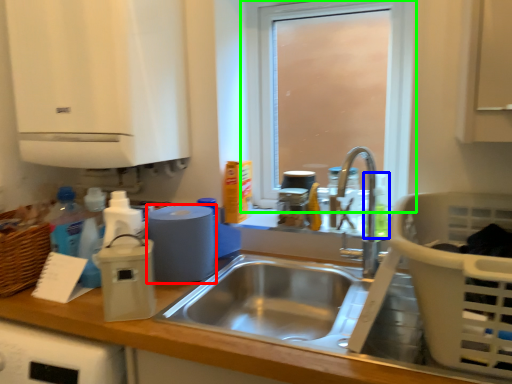
Question: Estimate the real-world distances between objects in this image. Which object is closer to appliance (highlighted by a red box), bottle (highlighted by a blue box) or window (highlighted by a green box)?

Choices:
 (A) bottle
 (B) window

Answer: (A)